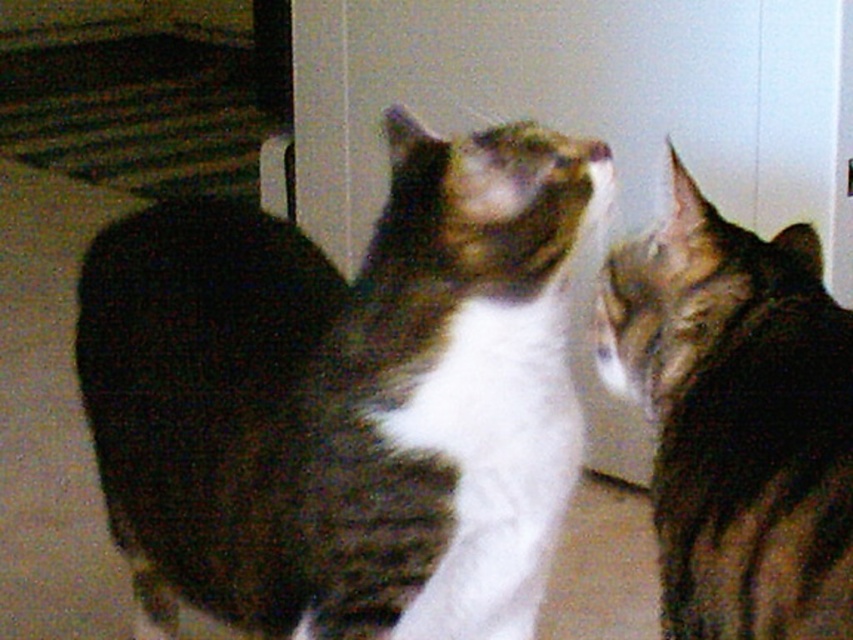
Question: Can you confirm if white fur cat at center is positioned below tabby fur cat at right?

Choices:
 (A) no
 (B) yes

Answer: (B)

Question: Does white fur cat at center have a lesser width compared to tabby fur cat at right?

Choices:
 (A) yes
 (B) no

Answer: (B)

Question: Observing the image, what is the correct spatial positioning of white fur cat at center in reference to tabby fur cat at right?

Choices:
 (A) left
 (B) right

Answer: (A)

Question: Which object appears closest to the camera in this image?

Choices:
 (A) white fur cat at center
 (B) tabby fur cat at right

Answer: (B)